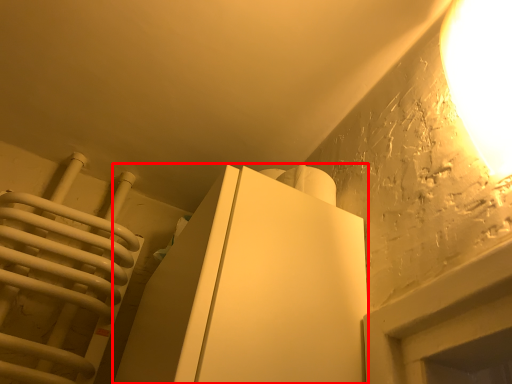
Question: In this image, where is furniture (annotated by the red box) located relative to lamp?

Choices:
 (A) left
 (B) right

Answer: (A)